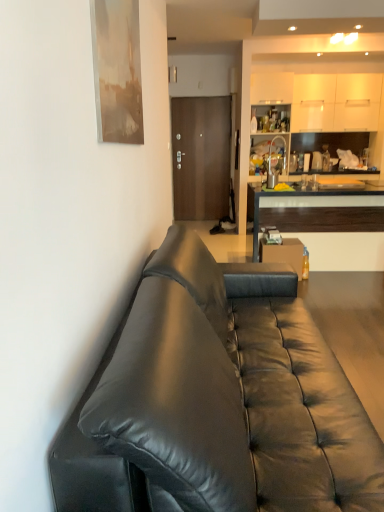
Question: In terms of width, does brown matte door at center look wider or thinner when compared to black leather couch at left?

Choices:
 (A) wide
 (B) thin

Answer: (B)

Question: From a real-world perspective, is brown matte door at center physically located above or below black leather couch at left?

Choices:
 (A) above
 (B) below

Answer: (A)

Question: Which object is positioned closest to the black leather couch at left?

Choices:
 (A) brown matte door at center
 (B) wooden cabinet at right

Answer: (B)

Question: Estimate the real-world distances between objects in this image. Which object is farther from the wooden cabinet at right?

Choices:
 (A) black leather couch at left
 (B) brown matte door at center

Answer: (A)